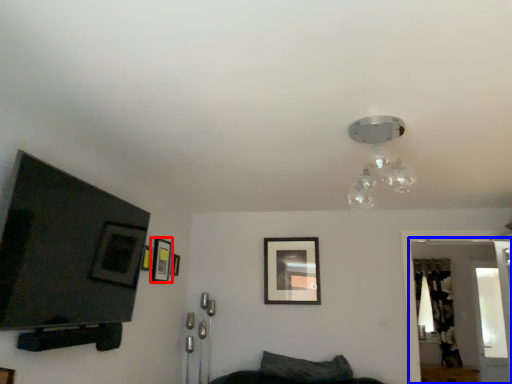
Question: Which object is closer to the camera taking this photo, picture frame (highlighted by a red box) or glass door (highlighted by a blue box)?

Choices:
 (A) picture frame
 (B) glass door

Answer: (A)